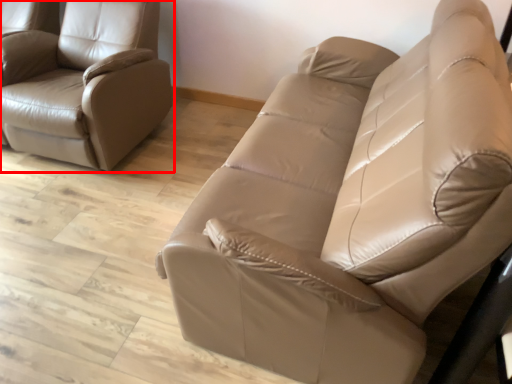
Question: Where is chair (annotated by the red box) located in relation to studio couch in the image?

Choices:
 (A) left
 (B) right

Answer: (A)